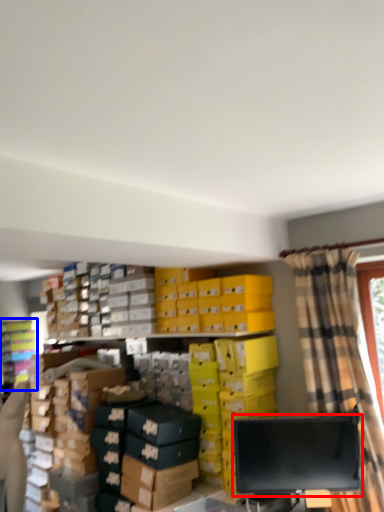
Question: Which object appears farthest to the camera in this image, computer monitor (highlighted by a red box) or shelf (highlighted by a blue box)?

Choices:
 (A) computer monitor
 (B) shelf

Answer: (B)